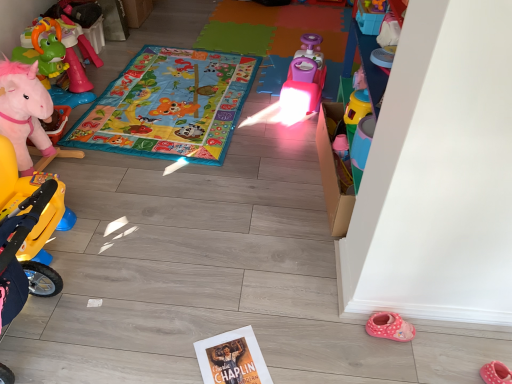
Describe the element at coordinates (55, 51) in the screenshot. I see `pink plush unicorn at left, placed as the third toy when sorted from right to left` at that location.

Describe the element at coordinates (496, 373) in the screenshot. This screenshot has height=384, width=512. I see `pink fabric slipper at lower right` at that location.

This screenshot has width=512, height=384. Identify the location of pink plush unicorn at left, the third toy when ordered from front to back. (55, 51).

Is multicolored fabric play mat at center touching pink plush unicorn at left, which ranks as the 1th toy in left-to-right order?

multicolored fabric play mat at center and pink plush unicorn at left, which ranks as the 1th toy in left-to-right order, are not in contact.

Considering the sizes of objects multicolored fabric play mat at center and pink plush unicorn at left, which ranks as the 1th toy in left-to-right order, in the image provided, who is smaller, multicolored fabric play mat at center or pink plush unicorn at left, which ranks as the 1th toy in left-to-right order,?

multicolored fabric play mat at center.

Is multicolored fabric play mat at center thinner than pink plush unicorn at left, the 1th toy viewed from the back?

No, multicolored fabric play mat at center is not thinner than pink plush unicorn at left, the 1th toy viewed from the back.

Is pink fabric slipper at lower right aimed at pink plush unicorn at left, which ranks as the 1th toy in left-to-right order?

No, pink fabric slipper at lower right is not turned towards pink plush unicorn at left, which ranks as the 1th toy in left-to-right order.

Is pink fabric slipper at lower right bigger or smaller than pink plush unicorn at left, the 1th toy viewed from the back?

pink fabric slipper at lower right is smaller than pink plush unicorn at left, the 1th toy viewed from the back.

How distant is pink fabric slipper at lower right from pink plush unicorn at left, which ranks as the 1th toy in left-to-right order?

pink fabric slipper at lower right and pink plush unicorn at left, which ranks as the 1th toy in left-to-right order, are 2.67 meters apart.

Is pink fabric slipper at lower right beside pink plush unicorn at left, the third toy when ordered from front to back?

No.

Considering the relative sizes of translucent plastic cup at center-right, marked as the third toy in a back-to-front arrangement, and pink fabric slipper at lower right in the image provided, is translucent plastic cup at center-right, marked as the third toy in a back-to-front arrangement, wider than pink fabric slipper at lower right?

Incorrect, the width of translucent plastic cup at center-right, marked as the third toy in a back-to-front arrangement, does not surpass that of pink fabric slipper at lower right.

Is translucent plastic cup at center-right, marked as the third toy in a left-to-right arrangement, oriented away from pink fabric slipper at lower right?

translucent plastic cup at center-right, marked as the third toy in a left-to-right arrangement, does not have its back to pink fabric slipper at lower right.

Are translucent plastic cup at center-right, which is the 1th toy in front-to-back order, and pink fabric slipper at lower right far apart?

That's right, there is a large distance between translucent plastic cup at center-right, which is the 1th toy in front-to-back order, and pink fabric slipper at lower right.

At what (x,y) coordinates should I click in order to perform the action: click on the 1st toy counting from the left of the pink fabric slipper at lower right. Please return your answer as a coordinate pair (x, y). Looking at the image, I should click on (356, 111).

Can you tell me how much pink plush unicorn at left, placed as the third toy when sorted from right to left, and multicolored fabric play mat at center differ in facing direction?

pink plush unicorn at left, placed as the third toy when sorted from right to left, and multicolored fabric play mat at center are facing 92.6 degrees away from each other.

Which object is wider, pink plush unicorn at left, placed as the third toy when sorted from right to left, or multicolored fabric play mat at center?

multicolored fabric play mat at center is wider.

From the image's perspective, is pink plush unicorn at left, the 1th toy viewed from the back, above multicolored fabric play mat at center?

Yes, from the image's perspective, pink plush unicorn at left, the 1th toy viewed from the back, is over multicolored fabric play mat at center.

Does pink plush unicorn at left, placed as the third toy when sorted from right to left, have a smaller size compared to multicolored fabric play mat at center?

Incorrect, pink plush unicorn at left, placed as the third toy when sorted from right to left, is not smaller in size than multicolored fabric play mat at center.

Between point (321, 68) and point (211, 129), which one is positioned in front?

The point (211, 129) is in front.

From the image's perspective, which one is positioned lower, pink plastic toy car at center, which is the 2th toy from right to left, or multicolored fabric play mat at center?

multicolored fabric play mat at center appears lower in the image.

Is pink plastic toy car at center, which is the second toy from front to back, positioned with its back to multicolored fabric play mat at center?

No, pink plastic toy car at center, which is the second toy from front to back, is not facing away from multicolored fabric play mat at center.

Can you confirm if translucent plastic cup at center-right, marked as the third toy in a back-to-front arrangement, is bigger than pink plastic toy car at center, the 2th toy in the back-to-front sequence?

Incorrect, translucent plastic cup at center-right, marked as the third toy in a back-to-front arrangement, is not larger than pink plastic toy car at center, the 2th toy in the back-to-front sequence.

Is translucent plastic cup at center-right, marked as the third toy in a back-to-front arrangement, wider than pink plastic toy car at center, which is the second toy from front to back?

No.

Is translucent plastic cup at center-right, marked as the third toy in a left-to-right arrangement, shorter than pink plastic toy car at center, which is the second toy from front to back?

Yes, translucent plastic cup at center-right, marked as the third toy in a left-to-right arrangement, is shorter than pink plastic toy car at center, which is the second toy from front to back.

Is pink plastic toy car at center, the 2th toy in the back-to-front sequence, at the back of translucent plastic cup at center-right, marked as the third toy in a left-to-right arrangement?

translucent plastic cup at center-right, marked as the third toy in a left-to-right arrangement, is not turned away from pink plastic toy car at center, the 2th toy in the back-to-front sequence.

Who is taller, pink fabric slipper at lower right or multicolored fabric play mat at center?

pink fabric slipper at lower right is taller.

Is point (509, 371) positioned behind point (101, 101)?

No, (509, 371) is closer to viewer.

The height and width of the screenshot is (384, 512). In order to click on blanket lying below the pink plush unicorn at left, the 1th toy viewed from the back (from the image's perspective) in this screenshot , I will do `click(169, 106)`.

Locate an element on the screen. This screenshot has width=512, height=384. footwear below the pink plush unicorn at left, the 1th toy viewed from the back (from a real-world perspective) is located at coordinates (496, 373).

Considering their positions, is pink plush unicorn at left, placed as the third toy when sorted from right to left, positioned closer to pink plastic toy car at center, which is the second toy from front to back, than pink fabric slipper at lower right?

pink plush unicorn at left, placed as the third toy when sorted from right to left, lies closer to pink plastic toy car at center, which is the second toy from front to back, than the other object.

When comparing their distances from pink fabric slipper at lower right, does translucent plastic cup at center-right, marked as the third toy in a left-to-right arrangement, or pink plastic toy car at center, positioned as the 2th toy in left-to-right order, seem further?

The object further to pink fabric slipper at lower right is pink plastic toy car at center, positioned as the 2th toy in left-to-right order.

Looking at the image, which one is located closer to translucent plastic cup at center-right, marked as the third toy in a back-to-front arrangement, pink fabric slipper at lower right or pink plastic toy car at center, positioned as the 2th toy in left-to-right order?

pink plastic toy car at center, positioned as the 2th toy in left-to-right order, lies closer to translucent plastic cup at center-right, marked as the third toy in a back-to-front arrangement, than the other object.

Estimate the real-world distances between objects in this image. Which object is closer to pink fabric slipper at lower right, translucent plastic cup at center-right, marked as the third toy in a left-to-right arrangement, or multicolored fabric play mat at center?

The object closer to pink fabric slipper at lower right is translucent plastic cup at center-right, marked as the third toy in a left-to-right arrangement.

Considering their positions, is pink plastic toy car at center, the 2th toy in the back-to-front sequence, positioned closer to pink fabric slipper at lower right than multicolored fabric play mat at center?

Among the two, pink plastic toy car at center, the 2th toy in the back-to-front sequence, is located nearer to pink fabric slipper at lower right.

Based on their spatial positions, is pink plush unicorn at left, the third toy when ordered from front to back, or pink plastic toy car at center, which is the 2th toy from right to left, further from pink fabric slipper at lower right?

Based on the image, pink plush unicorn at left, the third toy when ordered from front to back, appears to be further to pink fabric slipper at lower right.

Based on the photo, when comparing their distances from translucent plastic cup at center-right, which is the 1th toy in front-to-back order, does multicolored fabric play mat at center or pink plush unicorn at left, which ranks as the 1th toy in left-to-right order, seem further?

Among the two, pink plush unicorn at left, which ranks as the 1th toy in left-to-right order, is located further to translucent plastic cup at center-right, which is the 1th toy in front-to-back order.

From the image, which object appears to be nearer to pink plush unicorn at left, placed as the third toy when sorted from right to left, multicolored fabric play mat at center or pink plastic toy car at center, the 2th toy in the back-to-front sequence?

multicolored fabric play mat at center lies closer to pink plush unicorn at left, placed as the third toy when sorted from right to left, than the other object.

Where is `blanket between pink plush unicorn at left, the 1th toy viewed from the back, and pink fabric slipper at lower right from left to right`? This screenshot has height=384, width=512. blanket between pink plush unicorn at left, the 1th toy viewed from the back, and pink fabric slipper at lower right from left to right is located at coordinates (169, 106).

The image size is (512, 384). I want to click on blanket between pink plush unicorn at left, placed as the third toy when sorted from right to left, and pink plastic toy car at center, the 2th toy in the back-to-front sequence, from left to right, so click(x=169, y=106).

This screenshot has width=512, height=384. What are the coordinates of `toy between pink plastic toy car at center, positioned as the 2th toy in left-to-right order, and pink fabric slipper at lower right in the up-down direction` in the screenshot? It's located at (356, 111).

This screenshot has width=512, height=384. Identify the location of toy between multicolored fabric play mat at center and pink fabric slipper at lower right vertically. (356, 111).